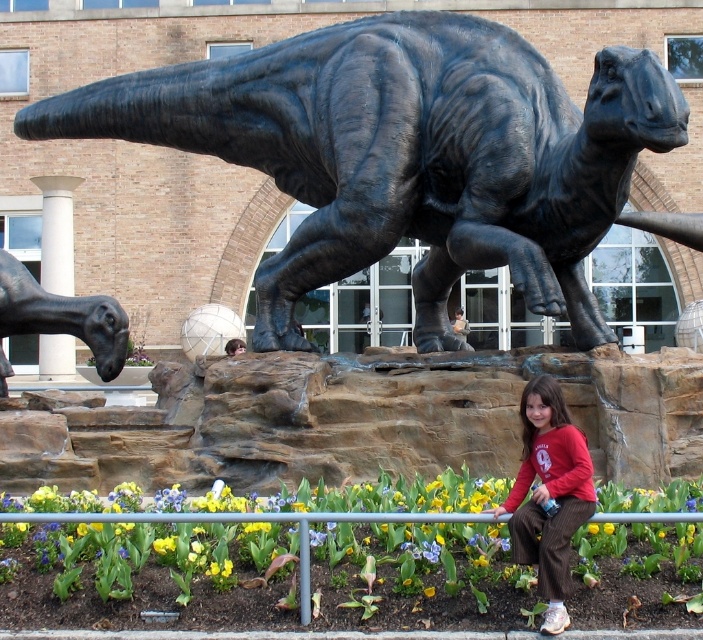
Question: Based on their relative distances, which object is farther from the matte red shirt at lower right?

Choices:
 (A) black polished stone dinosaur at center
 (B) shiny black statue at left

Answer: (A)

Question: Is matte red shirt at lower right to the right of shiny black statue at left from the viewer's perspective?

Choices:
 (A) no
 (B) yes

Answer: (B)

Question: Does black polished stone dinosaur at center lie in front of shiny black statue at left?

Choices:
 (A) yes
 (B) no

Answer: (A)

Question: Is black polished stone dinosaur at center to the left of shiny black statue at left from the viewer's perspective?

Choices:
 (A) no
 (B) yes

Answer: (A)

Question: Which of the following is the closest to the observer?

Choices:
 (A) matte red shirt at lower right
 (B) black polished stone dinosaur at center
 (C) shiny black statue at left

Answer: (A)

Question: Which of these objects is positioned closest to the shiny black statue at left?

Choices:
 (A) black polished stone dinosaur at center
 (B) matte red shirt at lower right

Answer: (B)